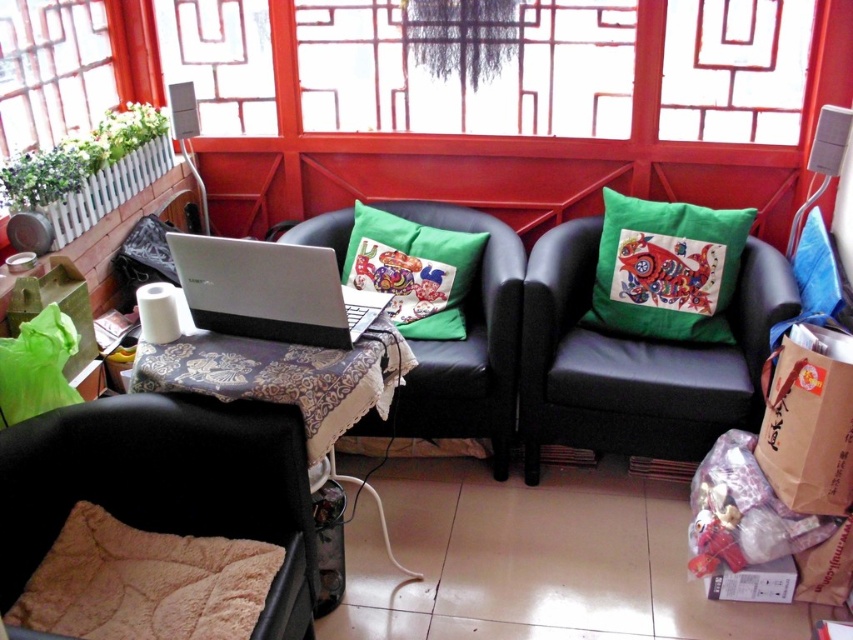
You are sitting on the black soft armchair at lower left and want to reach the green fabric pillow at center right. Is the pillow within easy arm reach from your current position?

The black soft armchair at lower left is closer to the viewer than the green fabric pillow at center right, so the pillow is further away. It might not be within easy arm reach from the armchair.

You are a guest entering the living room and want to sit on the lower seat. Which one between the black soft armchair at lower left and the black leather couch at right should you choose?

The black soft armchair at lower left has a lesser height compared to the black leather couch at right, so you should choose the black soft armchair at lower left as it is the lower seat.